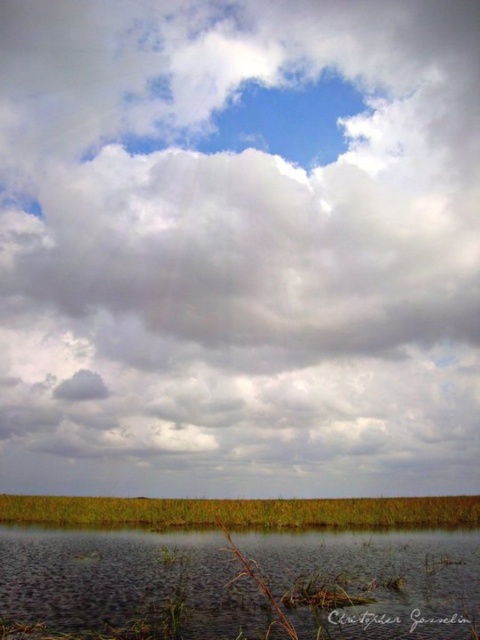
Question: Can you confirm if clear water at bottom is positioned to the right of green grass at lower center?

Choices:
 (A) no
 (B) yes

Answer: (B)

Question: Is clear water at bottom wider than green grass at lower center?

Choices:
 (A) yes
 (B) no

Answer: (B)

Question: Which object appears farthest from the camera in this image?

Choices:
 (A) green grass at lower center
 (B) clear water at bottom

Answer: (A)

Question: Which point is farther to the camera?

Choices:
 (A) pos(116,536)
 (B) pos(294,504)

Answer: (B)

Question: Does clear water at bottom have a greater width compared to green grass at lower center?

Choices:
 (A) yes
 (B) no

Answer: (B)